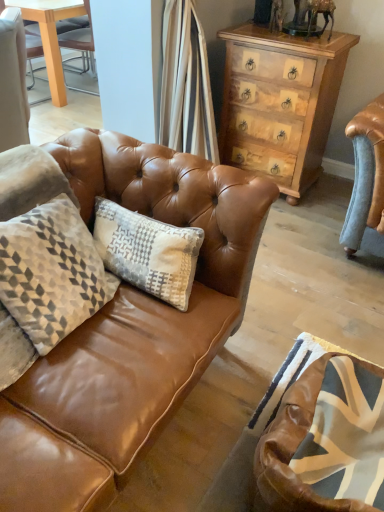
Question: Is brown leather swivel chair at lower right positioned with its back to matte brown leather couch at center?

Choices:
 (A) yes
 (B) no

Answer: (B)

Question: Would you say brown leather swivel chair at lower right contains matte brown leather couch at center?

Choices:
 (A) yes
 (B) no

Answer: (B)

Question: Can you confirm if brown leather swivel chair at lower right is positioned to the right of matte brown leather couch at center?

Choices:
 (A) no
 (B) yes

Answer: (A)

Question: Is brown leather swivel chair at lower right closer to the viewer compared to matte brown leather couch at center?

Choices:
 (A) yes
 (B) no

Answer: (A)

Question: Would you say brown leather swivel chair at lower right is outside matte brown leather couch at center?

Choices:
 (A) no
 (B) yes

Answer: (B)

Question: Is point (296, 379) positioned closer to the camera than point (284, 153)?

Choices:
 (A) closer
 (B) farther

Answer: (A)

Question: From the image's perspective, is brown leather swivel chair at lower right positioned above or below light brown wood chest of drawers at upper right?

Choices:
 (A) below
 (B) above

Answer: (A)

Question: Is brown leather swivel chair at lower right taller or shorter than light brown wood chest of drawers at upper right?

Choices:
 (A) short
 (B) tall

Answer: (A)

Question: Which is correct: brown leather swivel chair at lower right is inside light brown wood chest of drawers at upper right, or outside of it?

Choices:
 (A) outside
 (B) inside

Answer: (A)

Question: Is point (259, 133) positioned closer to the camera than point (322, 461)?

Choices:
 (A) closer
 (B) farther

Answer: (B)

Question: From the image's perspective, relative to brown leather swivel chair at lower right, is light brown wood chest of drawers at upper right above or below?

Choices:
 (A) above
 (B) below

Answer: (A)

Question: Is light brown wood chest of drawers at upper right wider or thinner than brown leather swivel chair at lower right?

Choices:
 (A) thin
 (B) wide

Answer: (B)

Question: Based on their positions, is light brown wood chest of drawers at upper right located to the left or right of brown leather swivel chair at lower right?

Choices:
 (A) right
 (B) left

Answer: (A)

Question: Is light brown wood chest of drawers at upper right wider or thinner than matte brown leather couch at center?

Choices:
 (A) wide
 (B) thin

Answer: (B)

Question: Considering the positions of point (301, 37) and point (226, 209), is point (301, 37) closer or farther from the camera than point (226, 209)?

Choices:
 (A) farther
 (B) closer

Answer: (A)